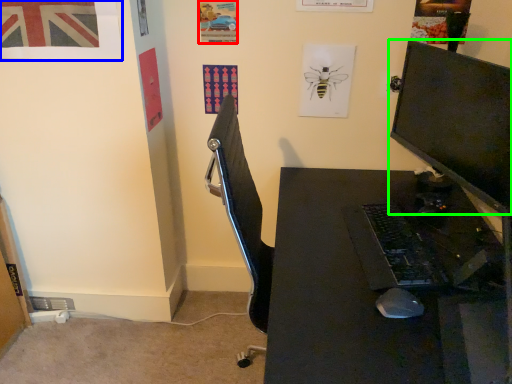
Question: Considering the real-world distances, which object is farthest from poster page (highlighted by a red box)? poster page (highlighted by a blue box) or computer monitor (highlighted by a green box)?

Choices:
 (A) poster page
 (B) computer monitor

Answer: (B)